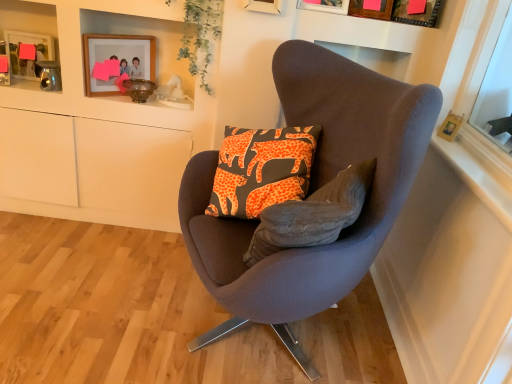
Question: Can you confirm if matte wooden picture frame at upper center, the 4th picture frame when ordered from right to left, is wider than green leafy plant at upper center?

Choices:
 (A) yes
 (B) no

Answer: (B)

Question: Can you confirm if matte wooden picture frame at upper center, the 4th picture frame when ordered from right to left, is thinner than green leafy plant at upper center?

Choices:
 (A) yes
 (B) no

Answer: (A)

Question: Is green leafy plant at upper center at the back of matte wooden picture frame at upper center, the 4th picture frame when ordered from right to left?

Choices:
 (A) yes
 (B) no

Answer: (B)

Question: Is matte wooden picture frame at upper center, the second picture frame from the left, surrounding green leafy plant at upper center?

Choices:
 (A) no
 (B) yes

Answer: (A)

Question: Is matte wooden picture frame at upper center, the 4th picture frame when ordered from right to left, located outside green leafy plant at upper center?

Choices:
 (A) yes
 (B) no

Answer: (A)

Question: Is matte wooden picture frame at upper center, the second picture frame from the left, further to the viewer compared to green leafy plant at upper center?

Choices:
 (A) yes
 (B) no

Answer: (B)

Question: Considering the relative sizes of brushed metal picture frame at upper left, which appears as the fifth picture frame when viewed from the right, and wooden picture frame at upper center, positioned as the 2th picture frame in right-to-left order, in the image provided, is brushed metal picture frame at upper left, which appears as the fifth picture frame when viewed from the right, thinner than wooden picture frame at upper center, positioned as the 2th picture frame in right-to-left order,?

Choices:
 (A) no
 (B) yes

Answer: (A)

Question: Is brushed metal picture frame at upper left, acting as the first picture frame starting from the left, not close to wooden picture frame at upper center, positioned as the 2th picture frame in right-to-left order?

Choices:
 (A) no
 (B) yes

Answer: (B)

Question: Does brushed metal picture frame at upper left, acting as the first picture frame starting from the left, have a larger size compared to wooden picture frame at upper center, positioned as the 2th picture frame in right-to-left order?

Choices:
 (A) no
 (B) yes

Answer: (A)

Question: Is brushed metal picture frame at upper left, which appears as the fifth picture frame when viewed from the right, not inside wooden picture frame at upper center, positioned as the 2th picture frame in right-to-left order?

Choices:
 (A) yes
 (B) no

Answer: (A)

Question: From the image's perspective, is brushed metal picture frame at upper left, which appears as the fifth picture frame when viewed from the right, located beneath wooden picture frame at upper center, positioned as the 2th picture frame in right-to-left order?

Choices:
 (A) yes
 (B) no

Answer: (A)

Question: Is brushed metal picture frame at upper left, which appears as the fifth picture frame when viewed from the right, at the left side of wooden picture frame at upper center, the 4th picture frame positioned from the left?

Choices:
 (A) yes
 (B) no

Answer: (A)

Question: Is the depth of brushed metal picture frame at upper left, which appears as the fifth picture frame when viewed from the right, greater than that of suede-like brown chair at center?

Choices:
 (A) no
 (B) yes

Answer: (B)